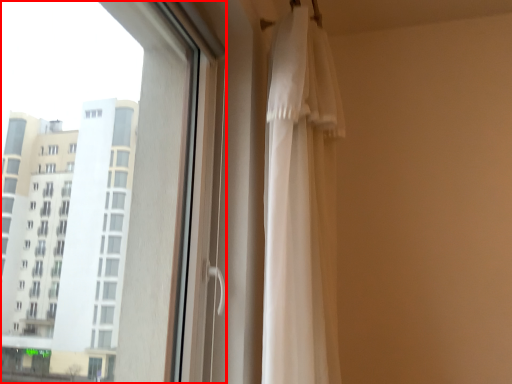
Question: From the image's perspective, what is the correct spatial relationship of window (annotated by the red box) in relation to curtain?

Choices:
 (A) above
 (B) below

Answer: (A)